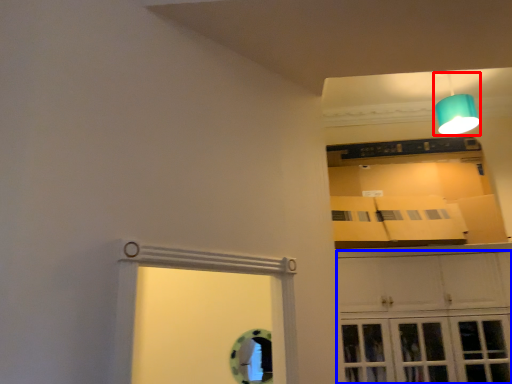
Question: Which point is closer to the camera, lamp (highlighted by a red box) or cabinetry (highlighted by a blue box)?

Choices:
 (A) lamp
 (B) cabinetry

Answer: (B)